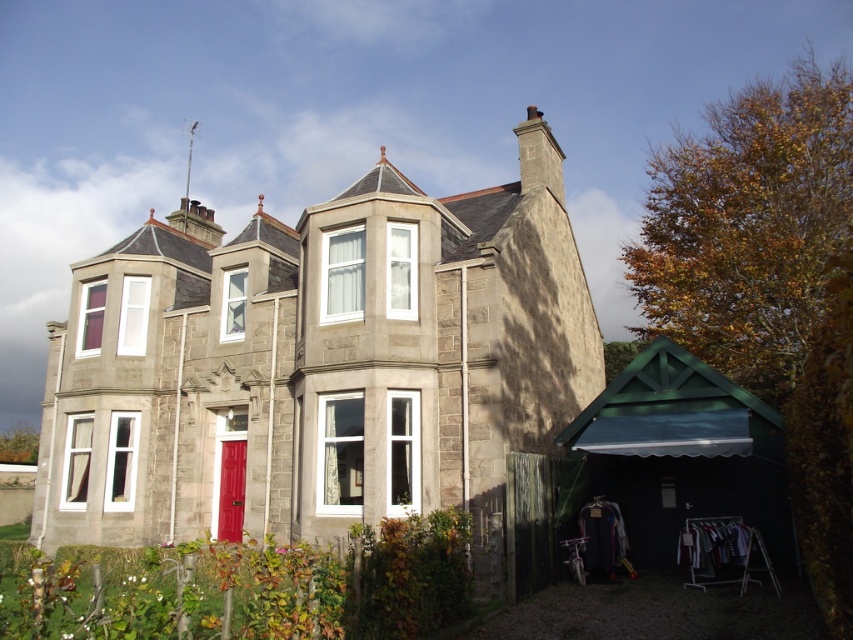
Is smooth stone chimney at center smaller than smooth stone chimney at upper center?

Yes, smooth stone chimney at center is smaller than smooth stone chimney at upper center.

Is point (103, 518) more distant than point (538, 148)?

No, (103, 518) is in front of (538, 148).

The width and height of the screenshot is (853, 640). I want to click on smooth stone chimney at center, so click(x=314, y=368).